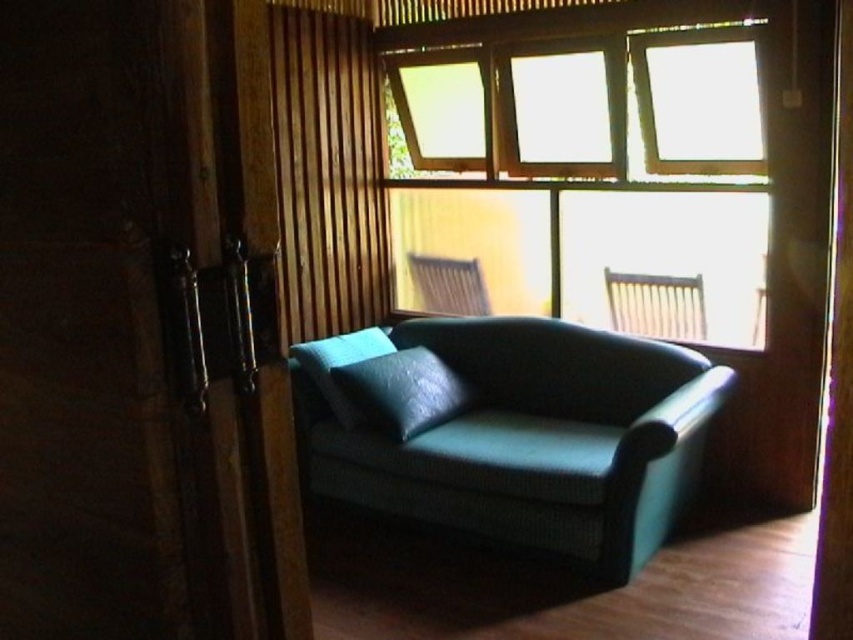
Question: Considering the relative positions of transparent glass window at upper center and teal leather armchair at center in the image provided, where is transparent glass window at upper center located with respect to teal leather armchair at center?

Choices:
 (A) above
 (B) below

Answer: (A)

Question: Considering the real-world distances, which object is farthest from the green fabric curtain at center?

Choices:
 (A) teal leather armchair at center
 (B) teal leather pillow at center

Answer: (A)

Question: Does teal leather armchair at center appear on the left side of teal fabric armchair at center?

Choices:
 (A) no
 (B) yes

Answer: (A)

Question: Considering the real-world distances, which object is closest to the teal leather pillow at center?

Choices:
 (A) teal fabric couch at center
 (B) teal leather armchair at center
 (C) teal fabric armchair at center

Answer: (A)

Question: Among these objects, which one is farthest from the camera?

Choices:
 (A) teal fabric pillow at center
 (B) teal leather armchair at center

Answer: (B)

Question: Does teal leather pillow at center have a greater width compared to teal fabric pillow at center?

Choices:
 (A) no
 (B) yes

Answer: (B)